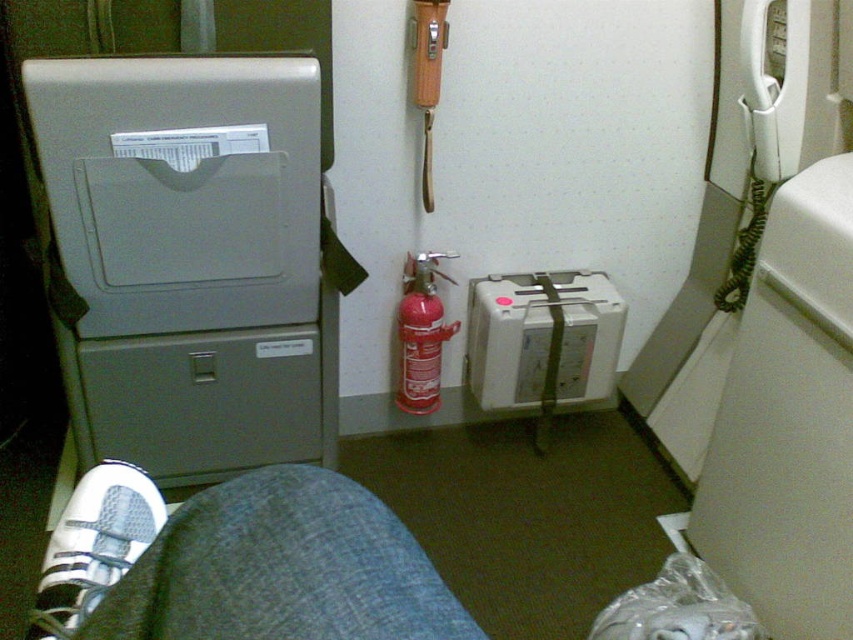
Please look at the point marked at coordinates (788, 420). What object is located there?

The white plastic toilet at right is located at point (788, 420).

You are a flight attendant needing to reach both the matte gray tray at upper left and the white mesh shoe at lower left during a safety check. Given that your reach is limited to 20 inches, can you comfortably access both items without moving your position?

The matte gray tray at upper left and white mesh shoe at lower left are 22.47 inches apart from each other. Since your reach is limited to 20 inches, you cannot comfortably access both items without moving your position.